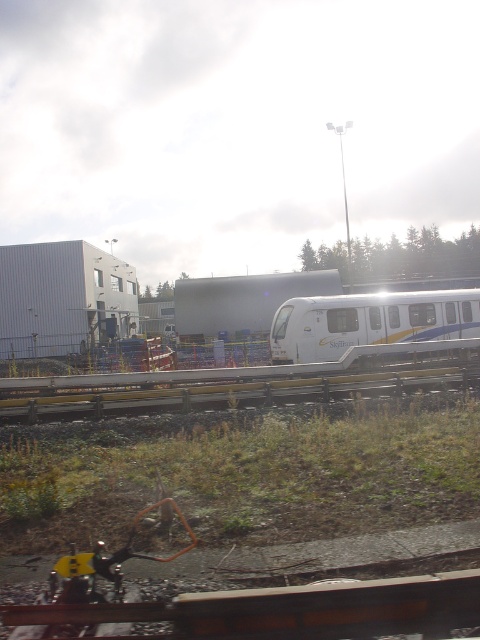
Consider the image. You are standing at the point where the SkyTrain is currently positioned on the track. Looking at the yellow metallic rail at center located at point (238, 387), in which direction should you move to reach it?

The yellow metallic rail at center is located at point (238, 387), so you should move towards that coordinate to reach it.

You are a railway inspector checking the SkyTrain system. You notice the yellow metallic rail at center and the white glossy passenger train at center. Which object is shorter in length?

The yellow metallic rail at center is shorter than the white glossy passenger train at center.

You are a maintenance worker inspecting the yellow metallic rail at center and the white glossy passenger train at center. Which object is smaller in size?

The yellow metallic rail at center is smaller than the white glossy passenger train at center according to the description.